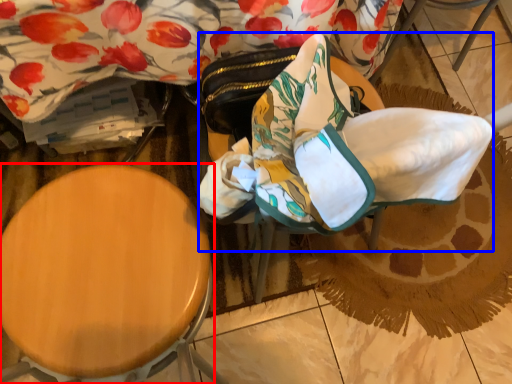
Question: Which object appears farthest to the camera in this image, furniture (highlighted by a red box) or swivel chair (highlighted by a blue box)?

Choices:
 (A) furniture
 (B) swivel chair

Answer: (B)